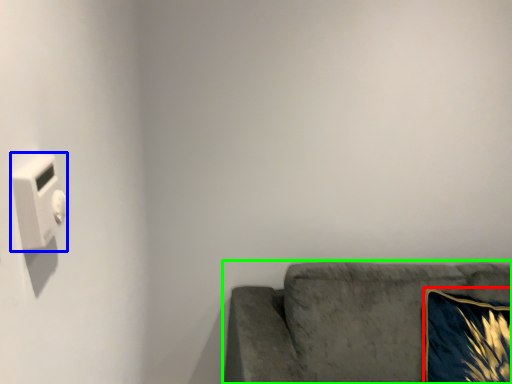
Question: Considering the real-world distances, which object is closest to throw pillow (highlighted by a red box)? light switch (highlighted by a blue box) or studio couch (highlighted by a green box).

Choices:
 (A) light switch
 (B) studio couch

Answer: (B)